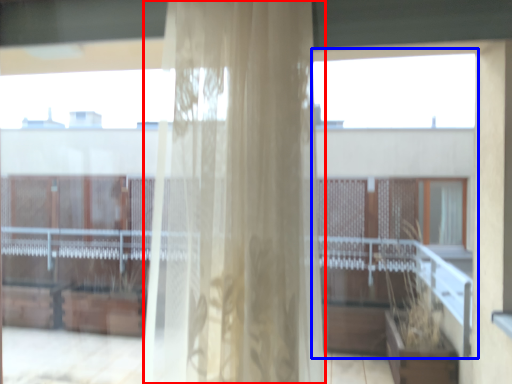
Question: Among these objects, which one is nearest to the camera, curtain (highlighted by a red box) or glass window (highlighted by a blue box)?

Choices:
 (A) curtain
 (B) glass window

Answer: (A)